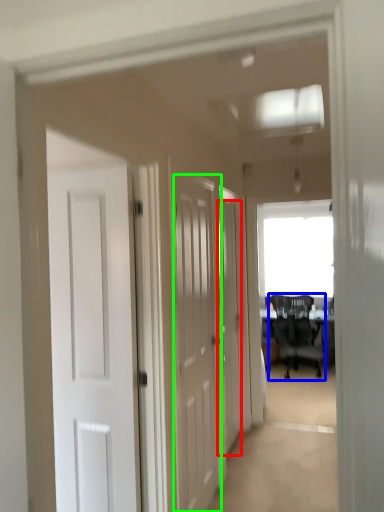
Question: Which object is the farthest from door (highlighted by a red box)? Choose among these: chair (highlighted by a blue box) or door (highlighted by a green box).

Choices:
 (A) chair
 (B) door

Answer: (A)